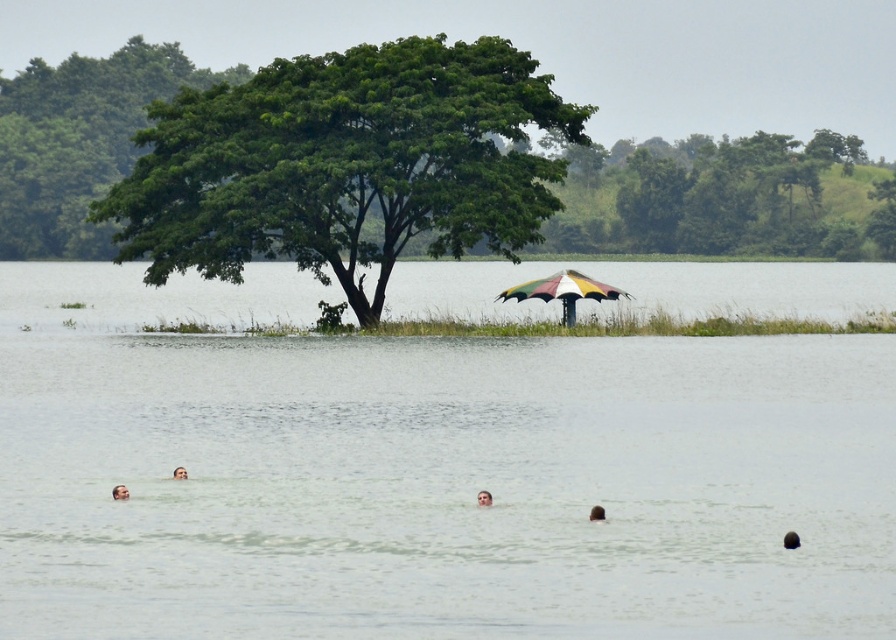
Question: Is the position of clear water at umbrella center more distant than that of brown skin at upper center?

Choices:
 (A) no
 (B) yes

Answer: (A)

Question: Which point is farther to the camera?

Choices:
 (A) (148, 49)
 (B) (498, 221)

Answer: (A)

Question: Is rainbow fabric umbrella at center positioned before brown matte head at center?

Choices:
 (A) no
 (B) yes

Answer: (A)

Question: Which point is farther to the camera?

Choices:
 (A) rainbow fabric umbrella at center
 (B) brown matte head at center

Answer: (A)

Question: Considering the real-world distances, which object is farthest from the brown skin at upper center?

Choices:
 (A) green leafy tree at upper left
 (B) brown hair at upper center
 (C) green leafy tree at center

Answer: (A)

Question: Is the position of green leafy tree at center more distant than that of brown skin at upper center?

Choices:
 (A) no
 (B) yes

Answer: (B)